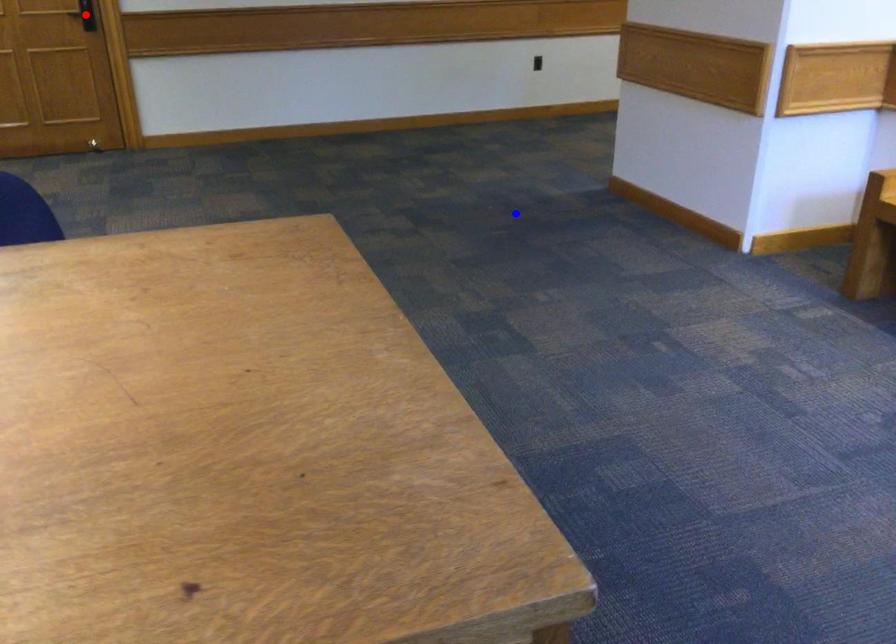
Question: Which of the two points in the image is closer to the camera?

Choices:
 (A) Blue point is closer.
 (B) Red point is closer.

Answer: (A)